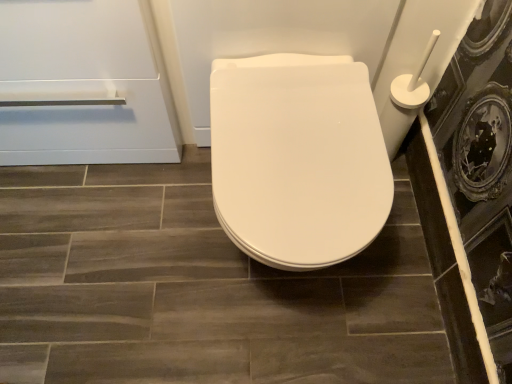
The width and height of the screenshot is (512, 384). In order to click on free point above matte ceramic tile at center (from a real-world perspective) in this screenshot , I will do `click(177, 266)`.